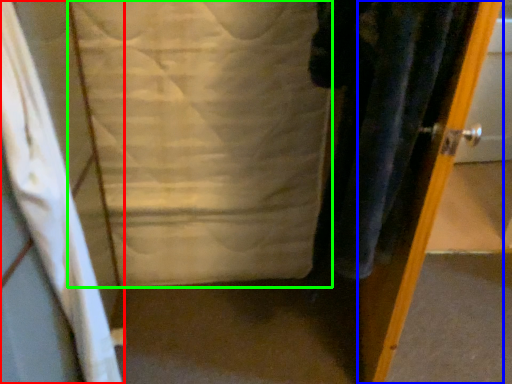
Question: Which is farther away from curtain (highlighted by a red box)? door (highlighted by a blue box) or sheet (highlighted by a green box)?

Choices:
 (A) door
 (B) sheet

Answer: (A)